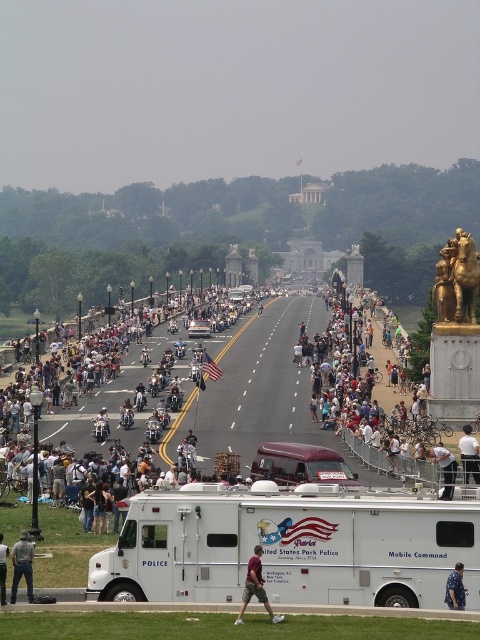
Can you confirm if maroon vinyl tour bus at center is smaller than gold/golden/statue at right?

Yes.

Locate an element on the screen. maroon vinyl tour bus at center is located at coordinates 300,465.

Does brown cotton shorts at center have a lesser height compared to white fabric shirt at lower right?

No.

The width and height of the screenshot is (480, 640). What are the coordinates of `brown cotton shorts at center` in the screenshot? It's located at (255, 588).

What do you see at coordinates (255, 588) in the screenshot? The image size is (480, 640). I see `brown cotton shorts at center` at bounding box center [255, 588].

Find the location of `brown cotton shorts at center`. brown cotton shorts at center is located at coordinates (255, 588).

Can you confirm if maroon vinyl tour bus at center is positioned above white fabric shirt at lower right?

Incorrect, maroon vinyl tour bus at center is not positioned above white fabric shirt at lower right.

Which is in front, point (254, 461) or point (448, 458)?

Point (448, 458) is more forward.

Identify the location of maroon vinyl tour bus at center. This screenshot has width=480, height=640. (300, 465).